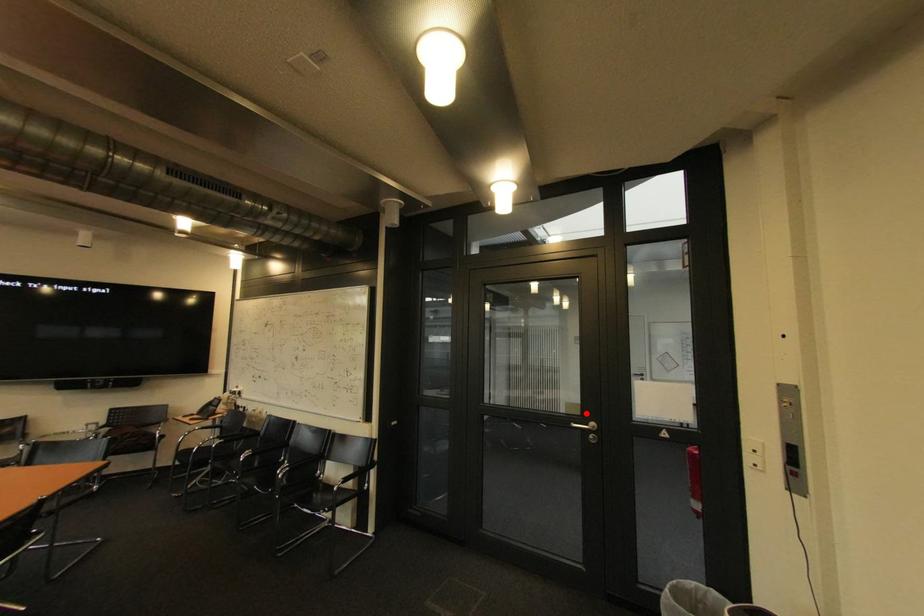
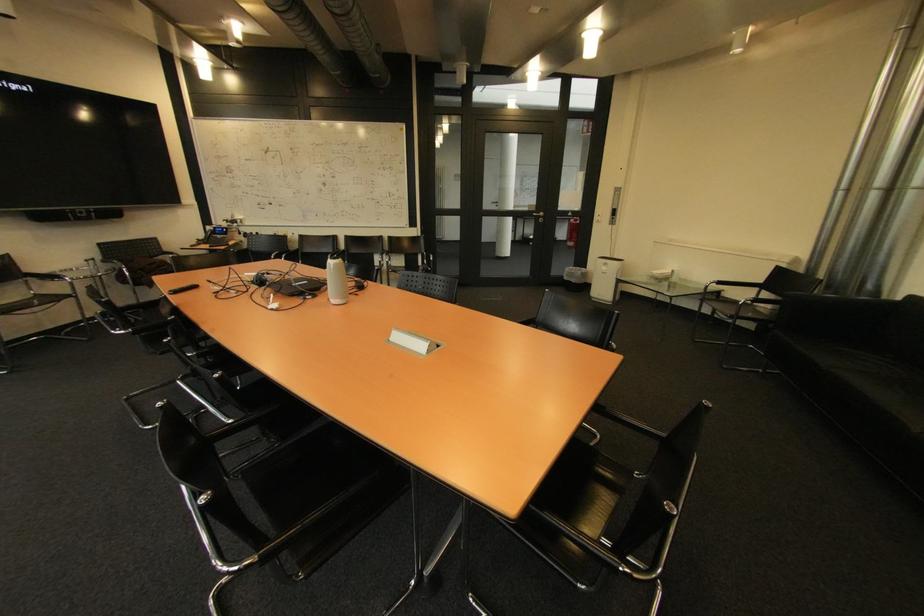
Question: A red point is marked in image1. In image2, is the corresponding 3D point closer to the camera or farther? Reply with the corresponding letter.

Choices:
 (A) The corresponding 3D point is closer.
 (B) The corresponding 3D point is farther.

Answer: (A)